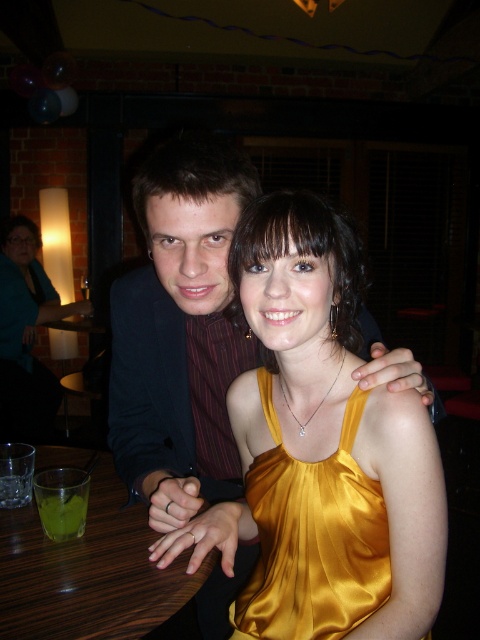
You are a photographer setting up for a group photo. You need to position a camera so that both the satin black suit at upper left and the green translucent glass at table left are in frame. Which object should you ensure is placed higher in the camera frame to include both?

The satin black suit at upper left is taller than the green translucent glass at table left, so you should position the camera to ensure the satin black suit at upper left is placed higher in the frame to include both.

You are a photographer standing at the point marked as point (88,572). You want to take a photo of the brown wood table at lower left. Is the table within your current line of sight?

Yes, the brown wood table at lower left is located at point (88,572), so it is directly in your line of sight.

You are a server at the bar and need to place a 6 inch tall drink on the brown wood table at lower left without it touching the green translucent glass at table left. Is there enough space between them?

The brown wood table at lower left is 6.12 inches from the green translucent glass at table left, so placing a 6 inch tall drink there would be safe as the distance between them is sufficient to avoid contact.